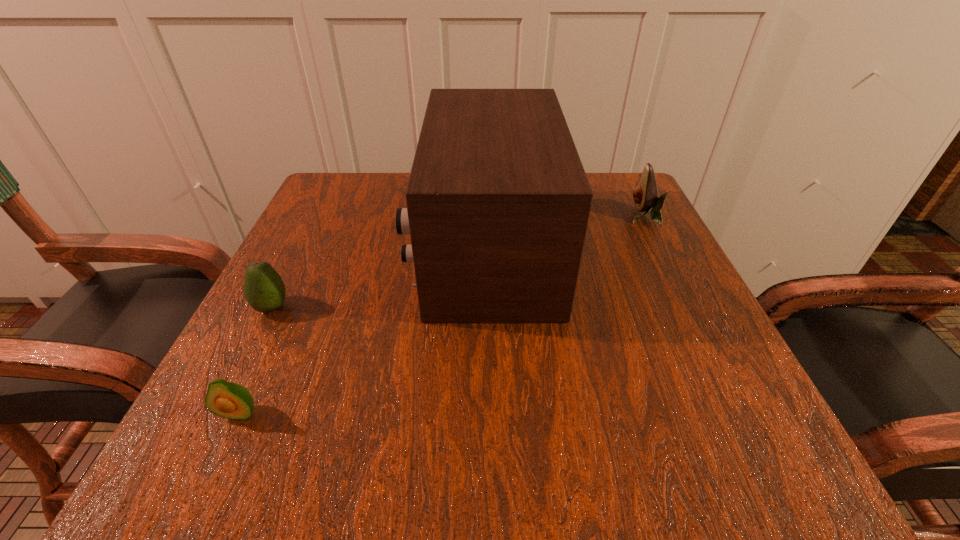
Where is `unoccupied position between the second farthest avocado and the radio receiver`? The height and width of the screenshot is (540, 960). unoccupied position between the second farthest avocado and the radio receiver is located at coordinates (379, 278).

This screenshot has height=540, width=960. In order to click on the third closest object to the tallest avocado in this screenshot , I will do `click(229, 400)`.

The height and width of the screenshot is (540, 960). I want to click on object that is the third closest to the nearest object, so click(645, 194).

In order to click on avocado that is the closest to the nearest avocado in this screenshot , I will do coord(264,289).

The image size is (960, 540). I want to click on avocado that stands as the closest to the second farthest avocado, so click(x=229, y=400).

Find the location of a particular element. The height and width of the screenshot is (540, 960). vacant region that satisfies the following two spatial constraints: 1. on the front-facing side of the tallest object; 2. on the cut side of the nearest avocado is located at coordinates (489, 413).

In order to click on vacant region that satisfies the following two spatial constraints: 1. on the seed side of the rightmost avocado; 2. on the cut side of the nearest object in this screenshot , I will do `click(741, 413)`.